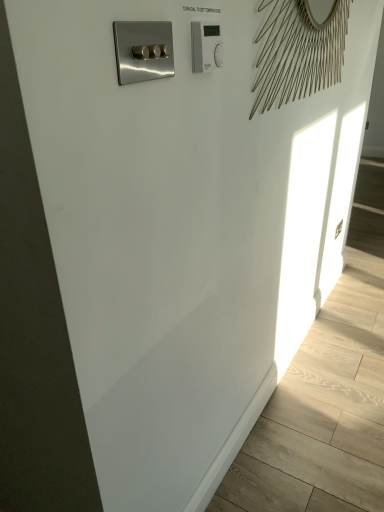
What are the coordinates of `white plastic thermostat at upper right` in the screenshot? It's located at (206, 47).

Image resolution: width=384 pixels, height=512 pixels. What do you see at coordinates (206, 47) in the screenshot?
I see `white plastic thermostat at upper right` at bounding box center [206, 47].

You are a GUI agent. You are given a task and a screenshot of the screen. Output one action in this format:
    pyautogui.click(x=<x>, y=<y>)
    Task: Click on the satin nickel switch at upper left
    
    Given the screenshot: What is the action you would take?
    pyautogui.click(x=143, y=51)

What do you see at coordinates (143, 51) in the screenshot?
I see `satin nickel switch at upper left` at bounding box center [143, 51].

Locate an element on the screen. white plastic thermostat at upper right is located at coordinates (206, 47).

Considering the relative positions of satin nickel switch at upper left and white plastic thermostat at upper right in the image provided, is satin nickel switch at upper left to the right of white plastic thermostat at upper right from the viewer's perspective?

No.

Looking at this image, which is in front, satin nickel switch at upper left or white plastic thermostat at upper right?

satin nickel switch at upper left.

Which is closer, (143, 41) or (213, 68)?

The point (143, 41) is more forward.

From the image's perspective, would you say satin nickel switch at upper left is shown under white plastic thermostat at upper right?

Yes, from the image's perspective, satin nickel switch at upper left is below white plastic thermostat at upper right.

From a real-world perspective, is satin nickel switch at upper left over white plastic thermostat at upper right?

No, from a real-world perspective, satin nickel switch at upper left is not over white plastic thermostat at upper right

Looking at their sizes, would you say satin nickel switch at upper left is wider or thinner than white plastic thermostat at upper right?

In the image, satin nickel switch at upper left appears to be more narrow than white plastic thermostat at upper right.

Based on the photo, can you confirm if satin nickel switch at upper left is shorter than white plastic thermostat at upper right?

Correct, satin nickel switch at upper left is not as tall as white plastic thermostat at upper right.

Who is bigger, satin nickel switch at upper left or white plastic thermostat at upper right?

satin nickel switch at upper left is bigger.

Do you think satin nickel switch at upper left is within white plastic thermostat at upper right, or outside of it?

satin nickel switch at upper left lies outside white plastic thermostat at upper right.

Are satin nickel switch at upper left and white plastic thermostat at upper right beside each other?

No, satin nickel switch at upper left is not making contact with white plastic thermostat at upper right.

Could you tell me if satin nickel switch at upper left is turned towards white plastic thermostat at upper right?

No, satin nickel switch at upper left is not facing towards white plastic thermostat at upper right.

The image size is (384, 512). What are the coordinates of `switch located in front of the white plastic thermostat at upper right` in the screenshot? It's located at click(143, 51).

Is white plastic thermostat at upper right at the right side of satin nickel switch at upper left?

Yes.

Does white plastic thermostat at upper right come in front of satin nickel switch at upper left?

No, white plastic thermostat at upper right is behind satin nickel switch at upper left.

Which is less distant, (208, 34) or (118, 63)?

The point (118, 63) is closer.

From the image's perspective, is white plastic thermostat at upper right positioned above or below satin nickel switch at upper left?

From the image's perspective, white plastic thermostat at upper right appears above satin nickel switch at upper left.

From a real-world perspective, between white plastic thermostat at upper right and satin nickel switch at upper left, who is vertically lower?

satin nickel switch at upper left, from a real-world perspective.

Which object is wider, white plastic thermostat at upper right or satin nickel switch at upper left?

white plastic thermostat at upper right is wider.

Can you confirm if white plastic thermostat at upper right is shorter than satin nickel switch at upper left?

Incorrect, the height of white plastic thermostat at upper right does not fall short of that of satin nickel switch at upper left.

Which of these two, white plastic thermostat at upper right or satin nickel switch at upper left, is smaller?

Smaller between the two is white plastic thermostat at upper right.

Is white plastic thermostat at upper right not inside satin nickel switch at upper left?

Yes, white plastic thermostat at upper right is located beyond the bounds of satin nickel switch at upper left.

Is white plastic thermostat at upper right beside satin nickel switch at upper left?

white plastic thermostat at upper right is not next to satin nickel switch at upper left, and they're not touching.

Could you tell me if white plastic thermostat at upper right is facing satin nickel switch at upper left?

No, white plastic thermostat at upper right is not aimed at satin nickel switch at upper left.

Can you tell me how much white plastic thermostat at upper right and satin nickel switch at upper left differ in facing direction?

0.0155 degrees separate the facing orientations of white plastic thermostat at upper right and satin nickel switch at upper left.

How distant is white plastic thermostat at upper right from satin nickel switch at upper left?

The distance of white plastic thermostat at upper right from satin nickel switch at upper left is 5.41 inches.

At what (x,y) coordinates should I click in order to perform the action: click on switch on the left of white plastic thermostat at upper right. Please return your answer as a coordinate pair (x, y). The width and height of the screenshot is (384, 512). Looking at the image, I should click on (143, 51).

At what (x,y) coordinates should I click in order to perform the action: click on switch lying below the white plastic thermostat at upper right (from the image's perspective). Please return your answer as a coordinate pair (x, y). This screenshot has width=384, height=512. Looking at the image, I should click on (143, 51).

I want to click on switch on the left of white plastic thermostat at upper right, so click(143, 51).